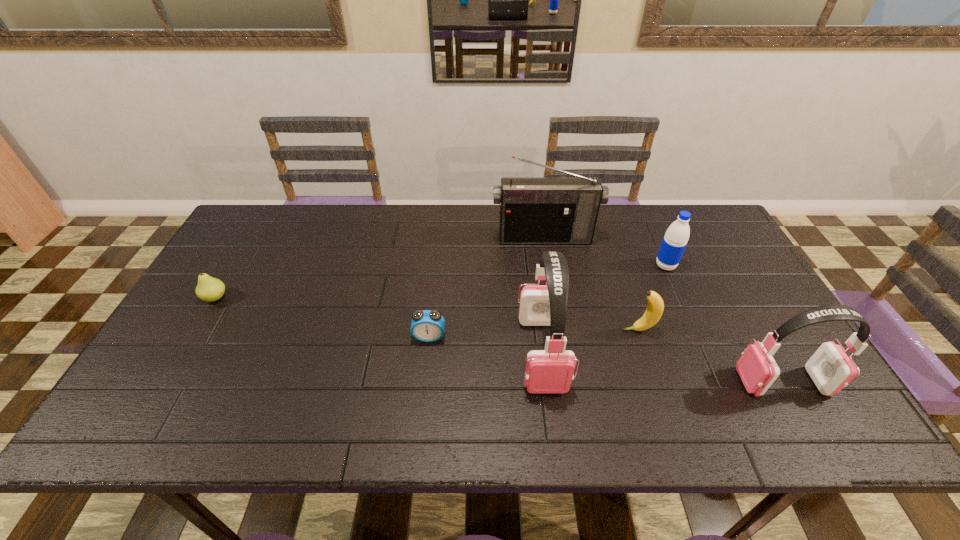
You are a GUI agent. You are given a task and a screenshot of the screen. Output one action in this format:
    pyautogui.click(x=<x>, y=<y>)
    Task: Click on the left earphone
    
    Given the screenshot: What is the action you would take?
    pyautogui.click(x=551, y=370)

Locate an element on the screen. Image resolution: width=960 pixels, height=540 pixels. the rightmost object is located at coordinates (830, 368).

Identify the location of the fifth shortest object. coord(830,368).

The width and height of the screenshot is (960, 540). Find the location of `the farthest object`. the farthest object is located at coordinates (533, 210).

Locate an element on the screen. water bottle is located at coordinates click(x=676, y=237).

This screenshot has height=540, width=960. In order to click on the fourth shortest object in this screenshot , I will do `click(676, 237)`.

Find the location of a particular element. banana is located at coordinates (655, 307).

Locate an element on the screen. alarm clock is located at coordinates (427, 326).

Locate an element on the screen. pear is located at coordinates (209, 289).

In order to click on the leftmost object in this screenshot , I will do `click(209, 289)`.